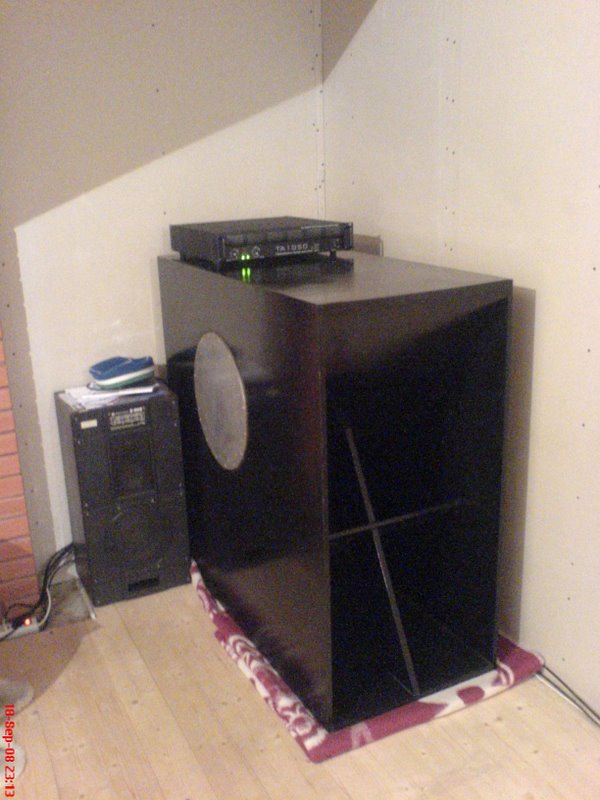
The image size is (600, 800). Find the location of `light brown floor`. light brown floor is located at coordinates (158, 706).